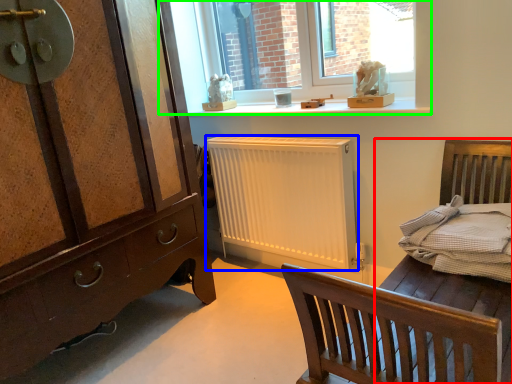
Question: Estimate the real-world distances between objects in this image. Which object is farther from bed frame (highlighted by a red box), radiator (highlighted by a blue box) or window (highlighted by a green box)?

Choices:
 (A) radiator
 (B) window

Answer: (B)